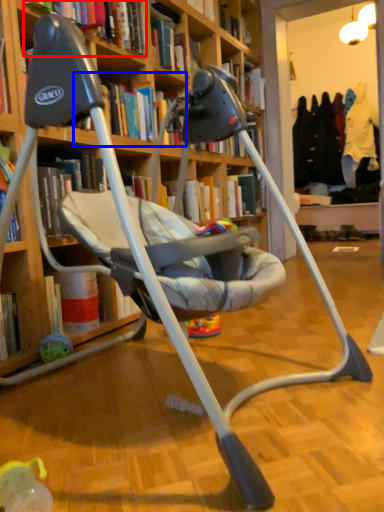
Question: Among these objects, which one is farthest to the camera, book (highlighted by a red box) or book (highlighted by a blue box)?

Choices:
 (A) book
 (B) book

Answer: (B)